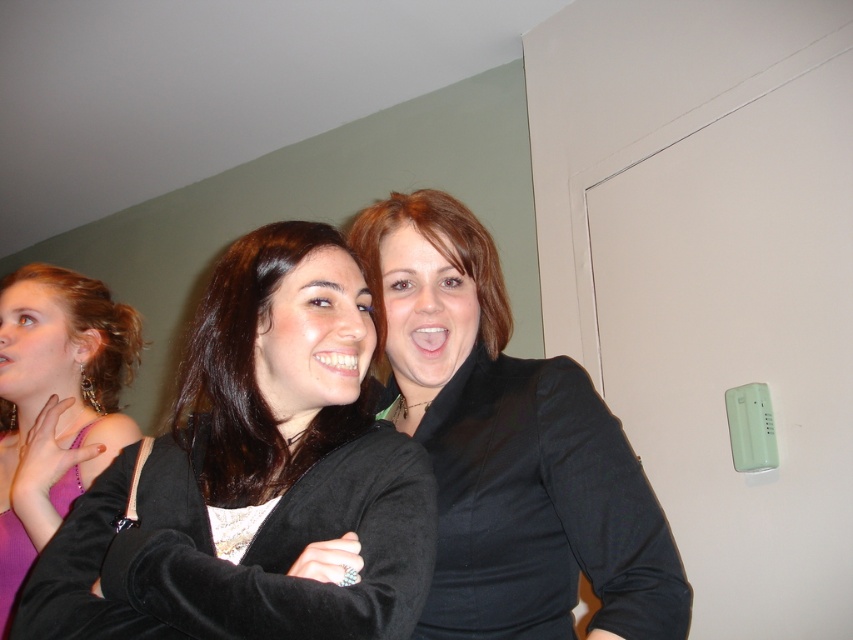
Question: Does black velvet jacket at center appear on the right side of pink satin dress at left?

Choices:
 (A) yes
 (B) no

Answer: (A)

Question: Is black velvet jacket at center further to camera compared to shiny black jacket at center?

Choices:
 (A) yes
 (B) no

Answer: (B)

Question: Which object appears farthest from the camera in this image?

Choices:
 (A) pink satin dress at left
 (B) black velvet jacket at center
 (C) black matte jacket at center
 (D) shiny black jacket at center

Answer: (A)

Question: Is black matte jacket at center wider than shiny black jacket at center?

Choices:
 (A) no
 (B) yes

Answer: (B)

Question: Which object is farther from the camera taking this photo?

Choices:
 (A) black velvet jacket at center
 (B) black matte jacket at center

Answer: (B)

Question: Which point is closer to the camera taking this photo?

Choices:
 (A) (212, 396)
 (B) (432, 202)
 (C) (13, 326)

Answer: (A)